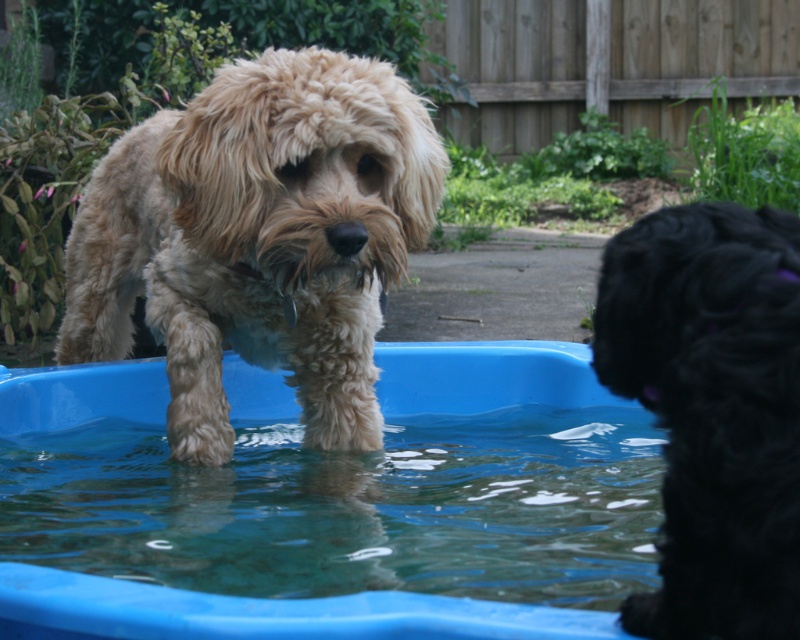
Question: Considering the relative positions of fuzzy beige dog at center and clear plastic water at center in the image provided, where is fuzzy beige dog at center located with respect to clear plastic water at center?

Choices:
 (A) left
 (B) right

Answer: (A)

Question: Which object is closer to the camera taking this photo?

Choices:
 (A) clear plastic water at center
 (B) black fuzzy dog at right
 (C) fuzzy beige dog at center

Answer: (B)

Question: Is black fuzzy dog at right positioned in front of clear plastic water at center?

Choices:
 (A) no
 (B) yes

Answer: (B)

Question: Which point is closer to the camera?

Choices:
 (A) clear plastic water at center
 (B) black fuzzy dog at right

Answer: (B)

Question: Based on their relative distances, which object is farther from the black fuzzy dog at right?

Choices:
 (A) clear plastic water at center
 (B) fuzzy beige dog at center

Answer: (A)

Question: Is the position of fuzzy beige dog at center more distant than that of clear plastic water at center?

Choices:
 (A) no
 (B) yes

Answer: (A)